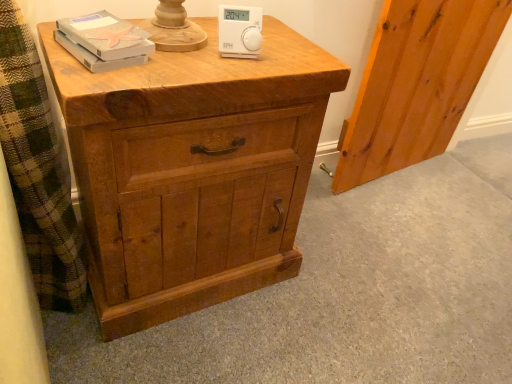
The width and height of the screenshot is (512, 384). Identify the location of vacant area that lies to the right of white plastic thermostat at upper center. (291, 56).